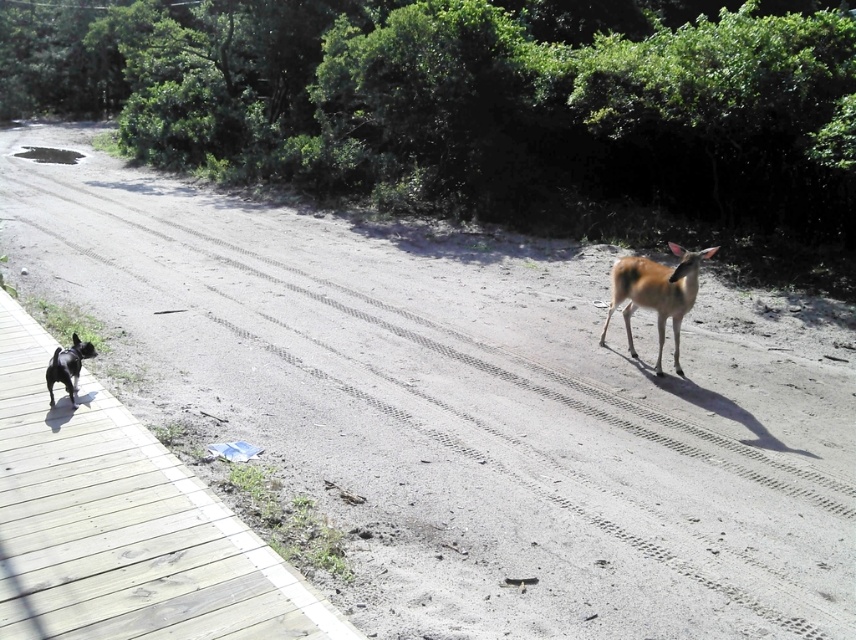
You are standing at the camera position and want to reach the point at coordinates [631,348]. The small black dog with a white patch on its chest is on the boardwalk on the left. Which direction should you walk to get closer to the point while avoiding the dog?

You should walk towards the right side of the dirt road since the point at [631,348] is 7.04 meters away from the camera and located on the right side of the road, away from the dog on the left boardwalk.